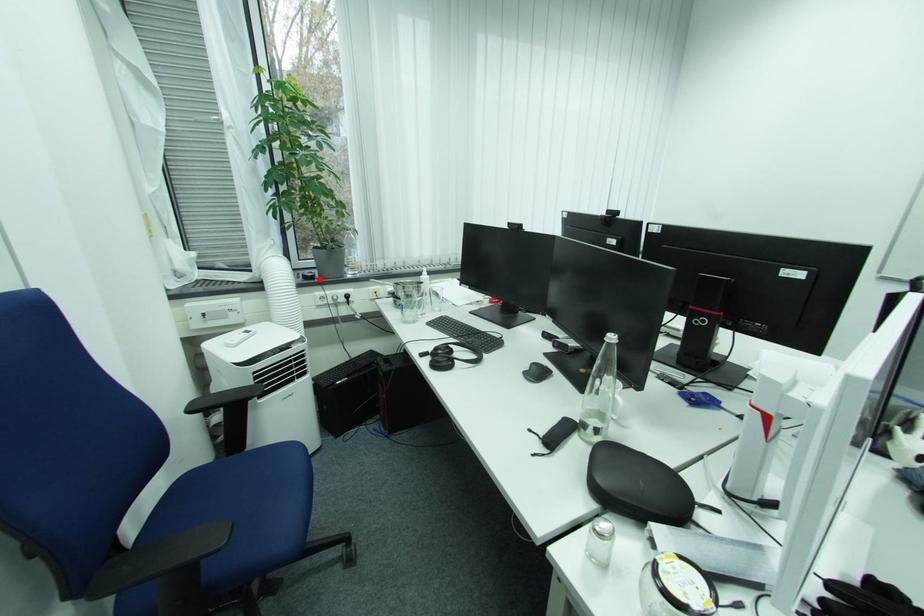
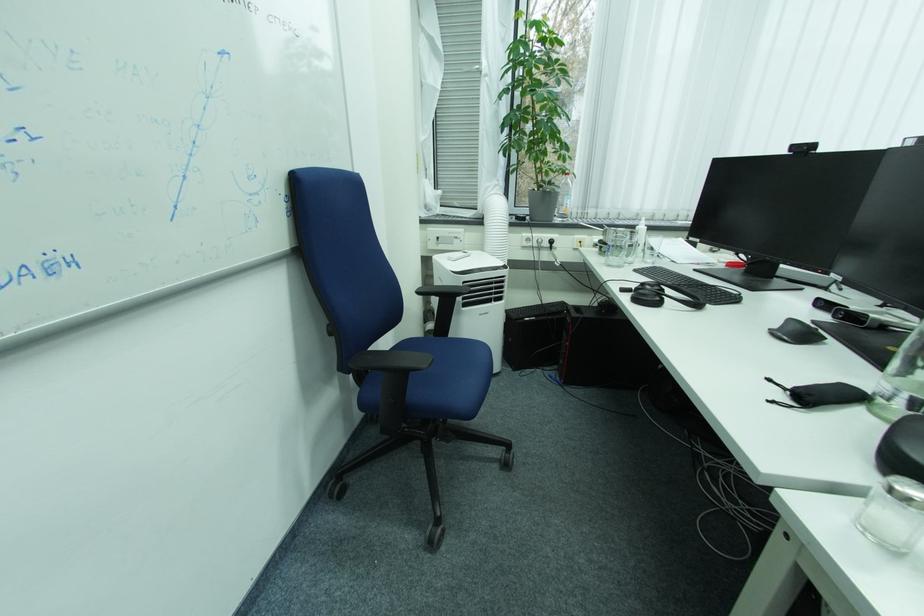
Where in the second image is the point corresponding to the highlighted location from the first image?

(530, 220)